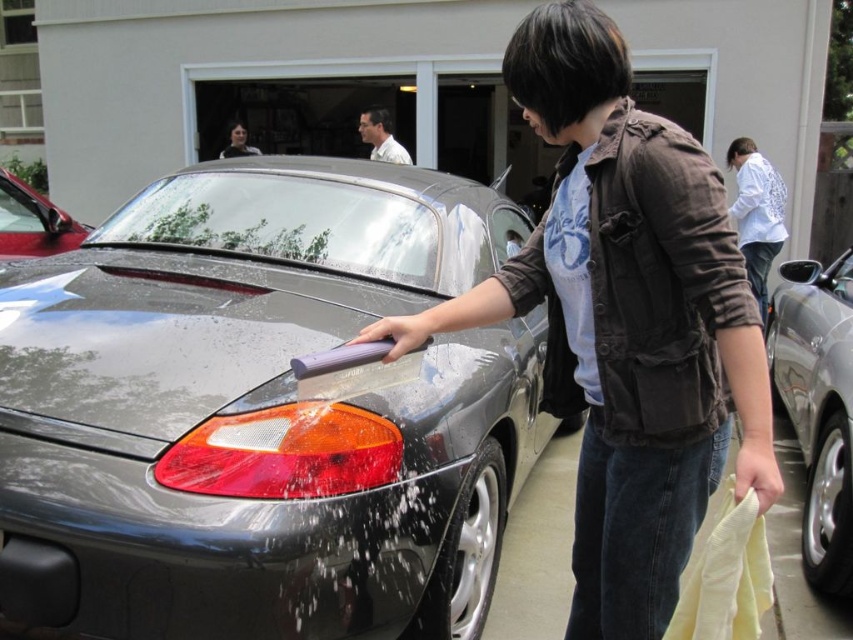
You are a delivery robot that is 1.2 meters tall. You need to deliver a package to the doorstep behind the glossy metallic car at center. Can you safely pass under the car without hitting your head?

The glossy metallic car at center and viewer are 1.58 meters apart from each other. Since the robot is 1.2 meters tall, it can safely pass under the car as the clearance is sufficient.

You are a delivery person with a box that is 2.8 meters long. You need to move it through the space between the satin silver car at right and the building wall. Is the space wide enough to fit the box?

The space between the satin silver car at right and the building wall is 2.70 meters, which is narrower than the 2.8 meters box. The box cannot fit through this space.

You are a fashion designer observing the scene. You need to determine which clothing item has a larger surface area between the matte black jacket at center and the white textured shirt at upper right. Which one do you think it is?

The matte black jacket at center is bigger than the white textured shirt at upper right, so the matte black jacket at center has a larger surface area.